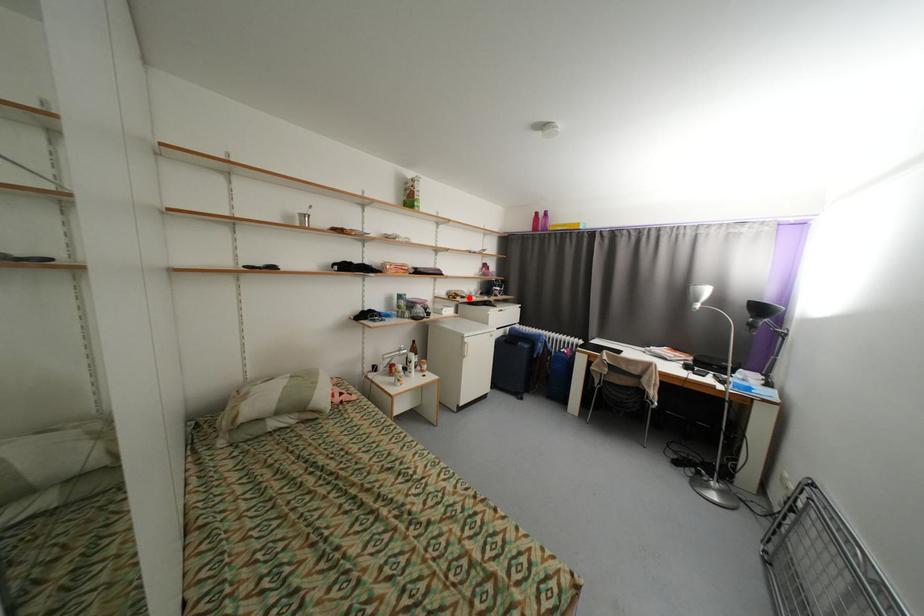
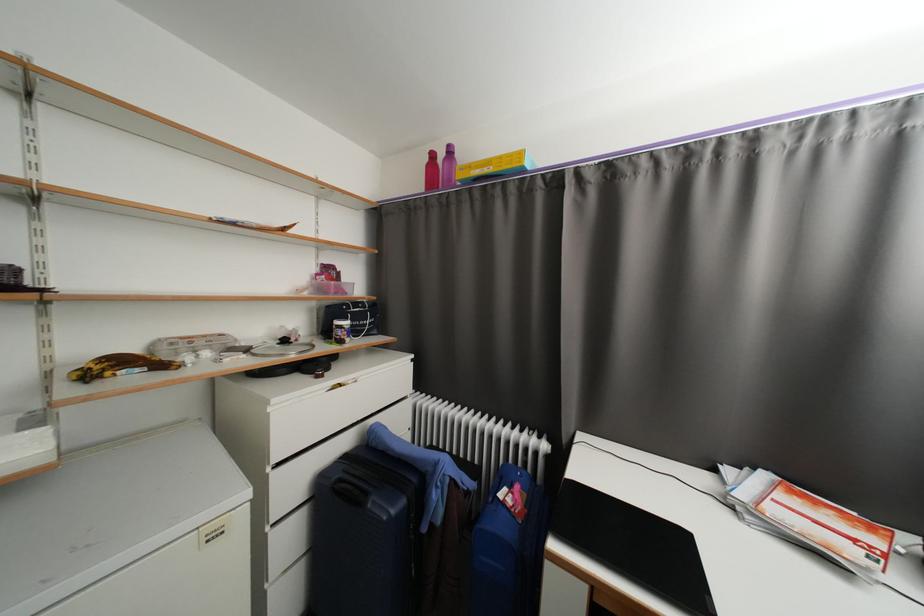
Locate, in the second image, the point that corresponds to the highlighted location in the first image.

(167, 367)